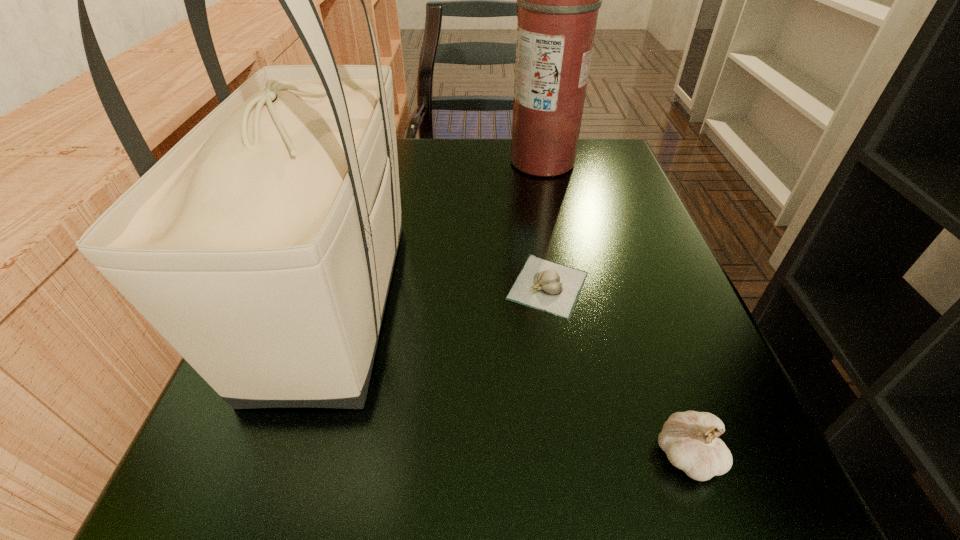
Where is `vacant space at the far right corner of the desktop`? The image size is (960, 540). vacant space at the far right corner of the desktop is located at coordinates (608, 190).

Where is `vacant space at the near right corner of the desktop`? The width and height of the screenshot is (960, 540). vacant space at the near right corner of the desktop is located at coordinates (684, 477).

Find the location of a particular element. free space between the leftmost object and the farthest object is located at coordinates (439, 232).

At what (x,y) coordinates should I click in order to perform the action: click on vacant area that lies between the fire extinguisher and the farther garlic. Please return your answer as a coordinate pair (x, y). Looking at the image, I should click on (545, 224).

You are a GUI agent. You are given a task and a screenshot of the screen. Output one action in this format:
    pyautogui.click(x=<x>, y=<y>)
    Task: Click on the free space between the left garlic and the taller garlic
    
    Given the screenshot: What is the action you would take?
    [617, 370]

This screenshot has width=960, height=540. Find the location of `vacant space that is in between the shortest object and the farthest object`. vacant space that is in between the shortest object and the farthest object is located at coordinates (545, 224).

Image resolution: width=960 pixels, height=540 pixels. In order to click on empty location between the farther garlic and the farthest object in this screenshot , I will do `click(545, 224)`.

This screenshot has width=960, height=540. In order to click on vacant area that lies between the fire extinguisher and the shorter garlic in this screenshot , I will do (545, 224).

Where is `vacant area between the farthest object and the shortest object`? Image resolution: width=960 pixels, height=540 pixels. vacant area between the farthest object and the shortest object is located at coordinates (545, 224).

The width and height of the screenshot is (960, 540). I want to click on unoccupied area between the shortest object and the shopping bag, so click(442, 293).